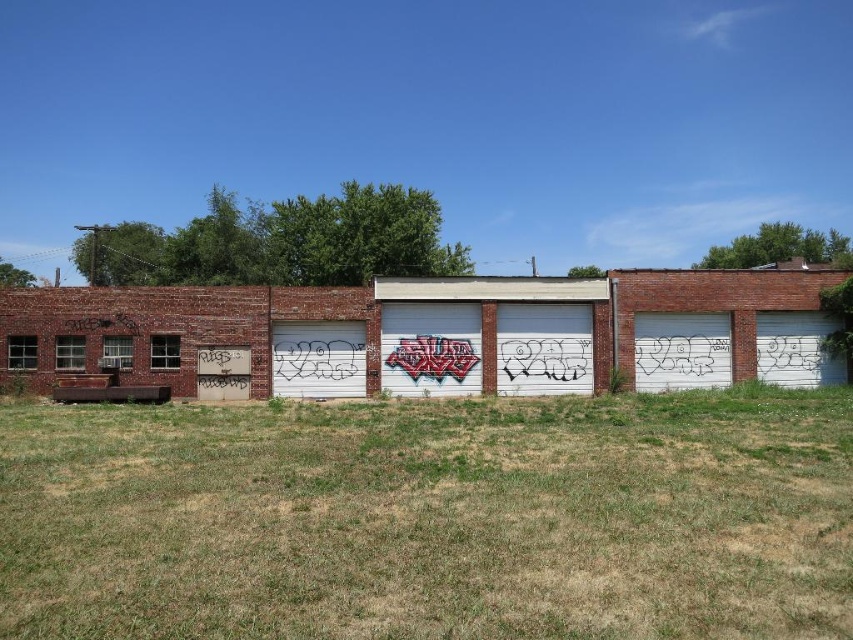
You are standing in front of the building and want to place a small potted plant on the ground. Which location would be better for the plant to get sunlight, the green grass at lower center or the area near the white matte garage door at center?

The green grass at lower center is positioned under the white matte garage door at center, so placing the plant there might block sunlight. The area near the white matte garage door at center would be better for sunlight exposure.

You are standing in front of the building and want to walk towards the white matte garage door at center. Which direction should you move relative to the green grass at lower center?

You should move to the left relative to the green grass at lower center because the green grass at lower center is positioned on the right side of the white matte garage door at center.

You are standing on the grassy area in front of the garage doors. You want to place a 1.5 meter long wooden bench between the green grass at lower center and the white matte garage door at center. Is there enough space to place the bench horizontally between them?

The distance between the green grass at lower center and the white matte garage door at center is 10.24 meters. Since the bench is only 1.5 meters long, there is ample space to place it horizontally between them.